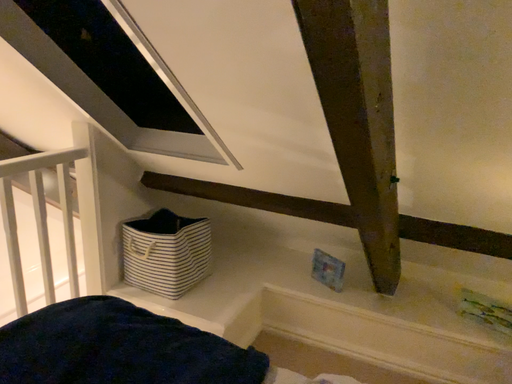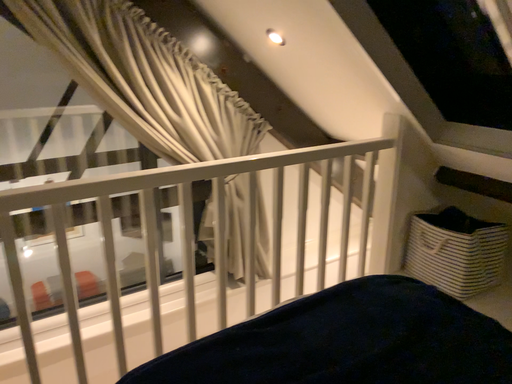
Question: How did the camera likely rotate when shooting the video?

Choices:
 (A) rotated left
 (B) rotated right

Answer: (A)